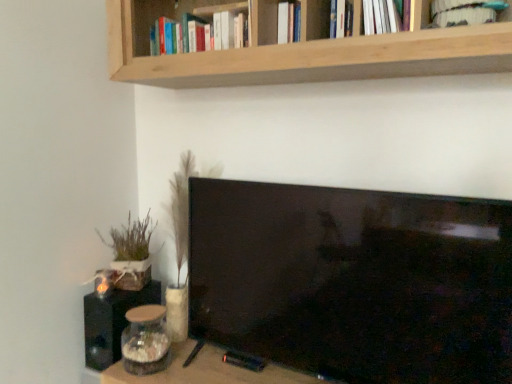
Question: From the image's perspective, is white fabric book at upper right, marked as the first book in a front-to-back arrangement, positioned above or below hardcover books at upper center, which is counted as the 2th book, starting from the right?

Choices:
 (A) above
 (B) below

Answer: (B)

Question: Is point coord(492,6) closer or farther from the camera than point coord(218,43)?

Choices:
 (A) closer
 (B) farther

Answer: (A)

Question: Considering the real-world distances, which object is closest to the wooden table at lower center?

Choices:
 (A) hardcover books at upper center, the 2th book when ordered from front to back
 (B) wooden box at left
 (C) natural wood shelf at upper center
 (D) black matte speaker at lower left
 (E) white fabric book at upper right, placed as the second book when sorted from back to front

Answer: (D)

Question: Which object is the farthest from the hardcover books at upper center, the 2th book when ordered from front to back?

Choices:
 (A) wooden table at lower center
 (B) black matte speaker at lower left
 (C) white fabric book at upper right, marked as the first book in a front-to-back arrangement
 (D) natural wood shelf at upper center
 (E) wooden box at left

Answer: (A)